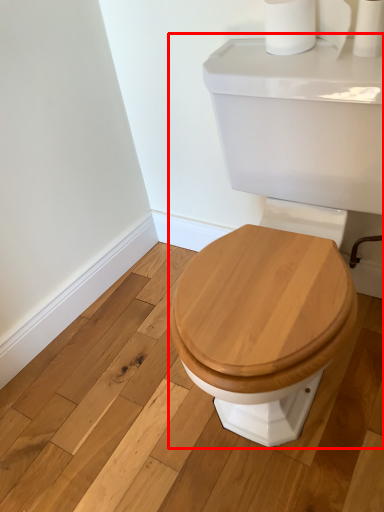
Question: From the image's perspective, what is the correct spatial positioning of porcelain (annotated by the red box) in reference to toilet paper?

Choices:
 (A) below
 (B) above

Answer: (A)